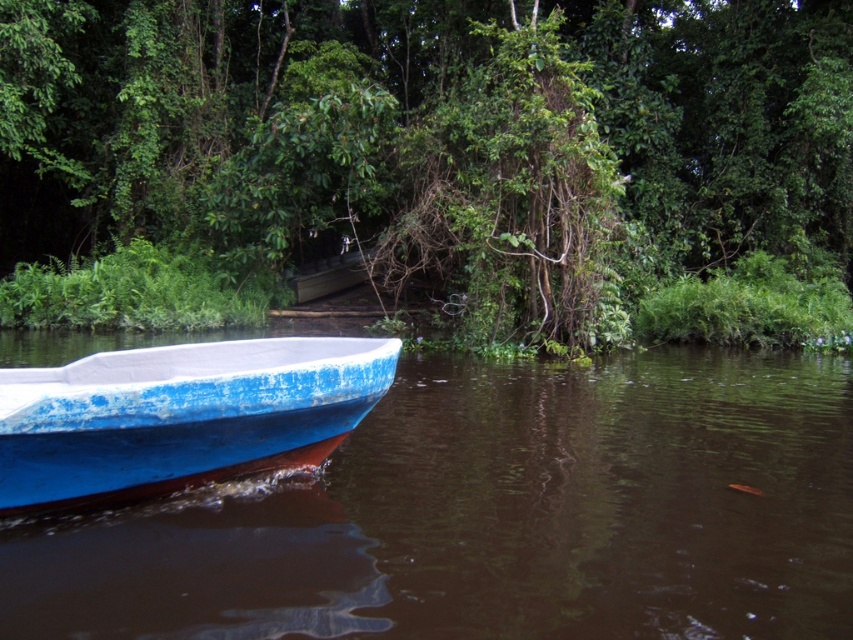
Who is positioned more to the right, blue painted wood boat at lower left or blue matte boat at lower left?

blue painted wood boat at lower left is more to the right.

Which is below, blue painted wood boat at lower left or blue matte boat at lower left?

Positioned lower is blue painted wood boat at lower left.

Is point (221, 577) more distant than point (123, 493)?

No, it is not.

Where is `blue painted wood boat at lower left`? Image resolution: width=853 pixels, height=640 pixels. blue painted wood boat at lower left is located at coordinates 496,515.

Who is positioned more to the left, green leafy tree at center or blue matte boat at lower left?

green leafy tree at center

Is green leafy tree at center to the left of blue matte boat at lower left from the viewer's perspective?

Correct, you'll find green leafy tree at center to the left of blue matte boat at lower left.

Between point (596, 51) and point (149, 416), which one is positioned behind?

The point (596, 51) is behind.

The image size is (853, 640). What are the coordinates of `green leafy tree at center` in the screenshot? It's located at (434, 163).

You are a GUI agent. You are given a task and a screenshot of the screen. Output one action in this format:
    pyautogui.click(x=<x>, y=<y>)
    Task: Click on the green leafy tree at center
    The width and height of the screenshot is (853, 640).
    Given the screenshot: What is the action you would take?
    pyautogui.click(x=434, y=163)

Between point (7, 134) and point (697, 534), which one is positioned in front?

Positioned in front is point (697, 534).

Is point (291, 58) more distant than point (639, 612)?

Yes, point (291, 58) is farther from viewer.

At what (x,y) coordinates should I click in order to perform the action: click on green leafy tree at center. Please return your answer as a coordinate pair (x, y). The width and height of the screenshot is (853, 640). Looking at the image, I should click on (434, 163).